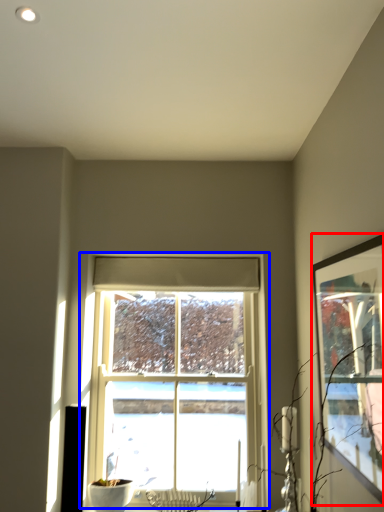
Question: Among these objects, which one is nearest to the camera, picture frame (highlighted by a red box) or window (highlighted by a blue box)?

Choices:
 (A) picture frame
 (B) window

Answer: (A)